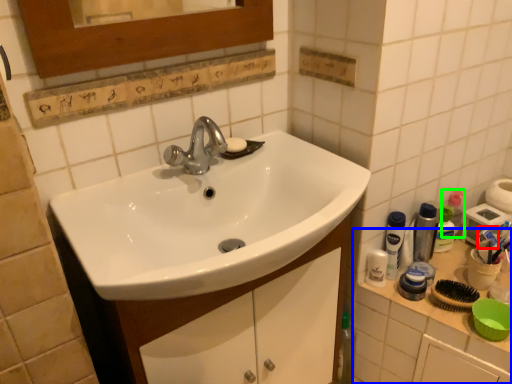
Question: Which object is the farthest from toothpaste (highlighted by a red box)? Choose among these: counter top (highlighted by a blue box) or mouthwash (highlighted by a green box).

Choices:
 (A) counter top
 (B) mouthwash

Answer: (A)